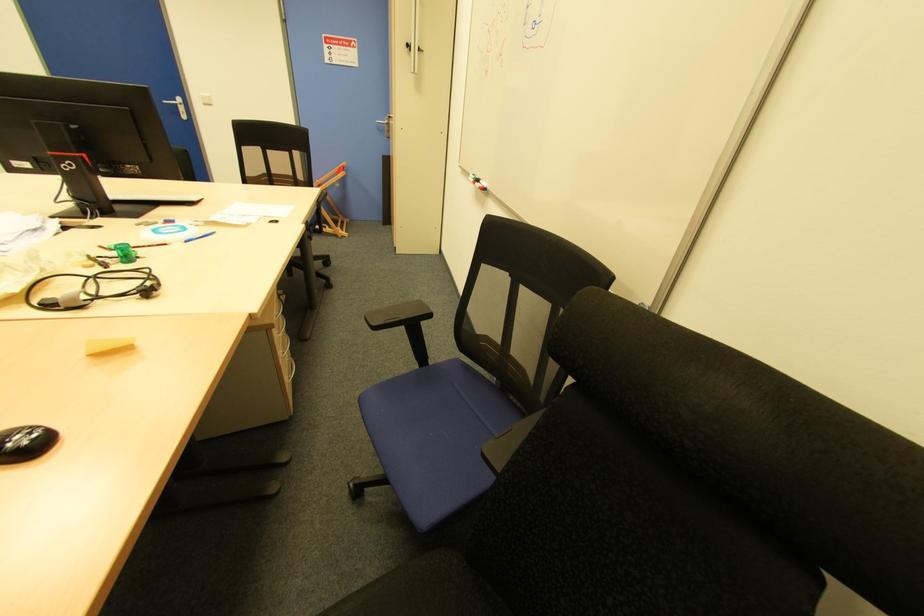
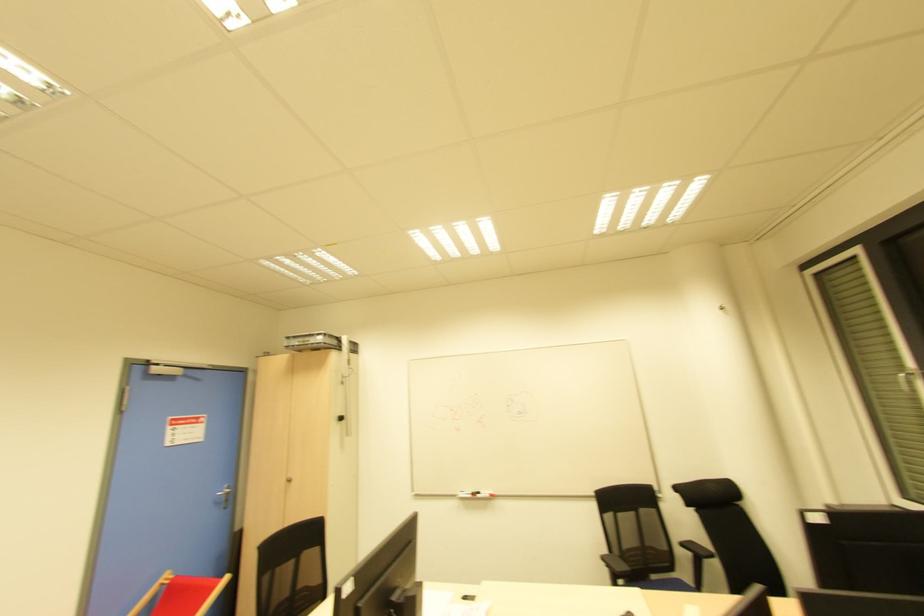
The point at (477,185) is marked in the first image. Where is the corresponding point in the second image?

(478, 496)